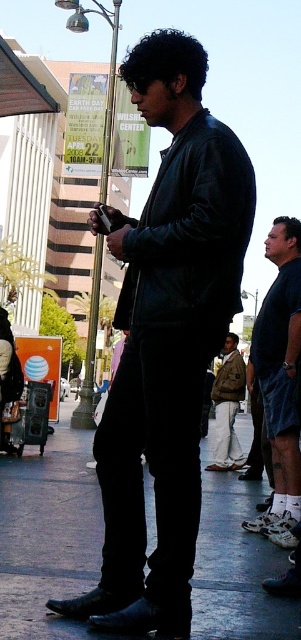
You are a pedestrian on the sidewalk and see the matte black jacket at center and the camouflage jacket at center. Which one is positioned more to the left?

The matte black jacket at center is positioned more to the left than the camouflage jacket at center.

Please look at the point marked as point (165, 339) in the image. What object is located at this point?

The point (165, 339) corresponds to the matte black jacket at center.

You are a delivery robot positioned at the origin point of the image coordinate system. You need to deliver a package to the black leather shoes at lower center located at point 0.836, 0.159. What is the shortest path you can take to reach the shoes without crossing any obstacles?

The shortest path to the black leather shoes at lower center would be a straight line from the origin to the coordinates (47, 534), assuming no obstacles are present in the image.